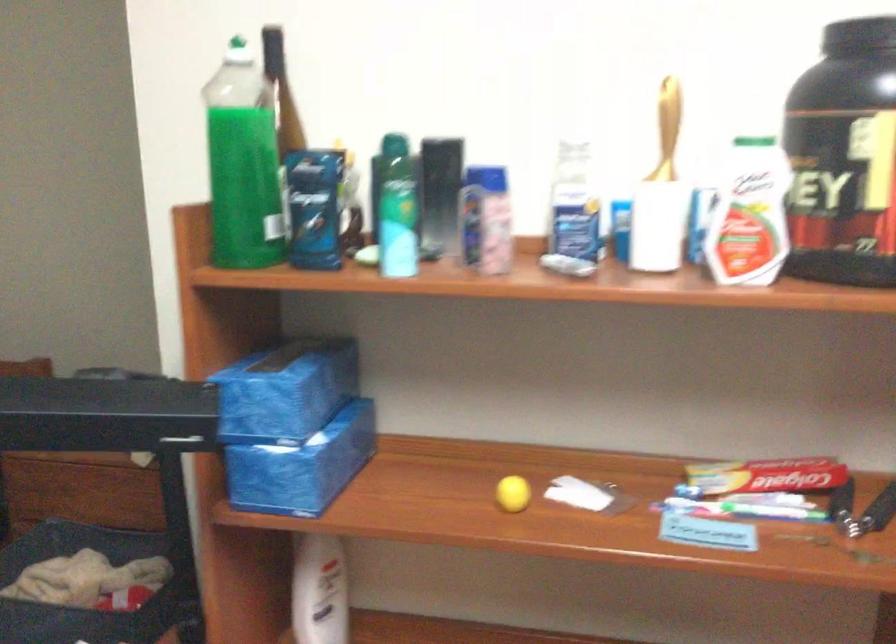
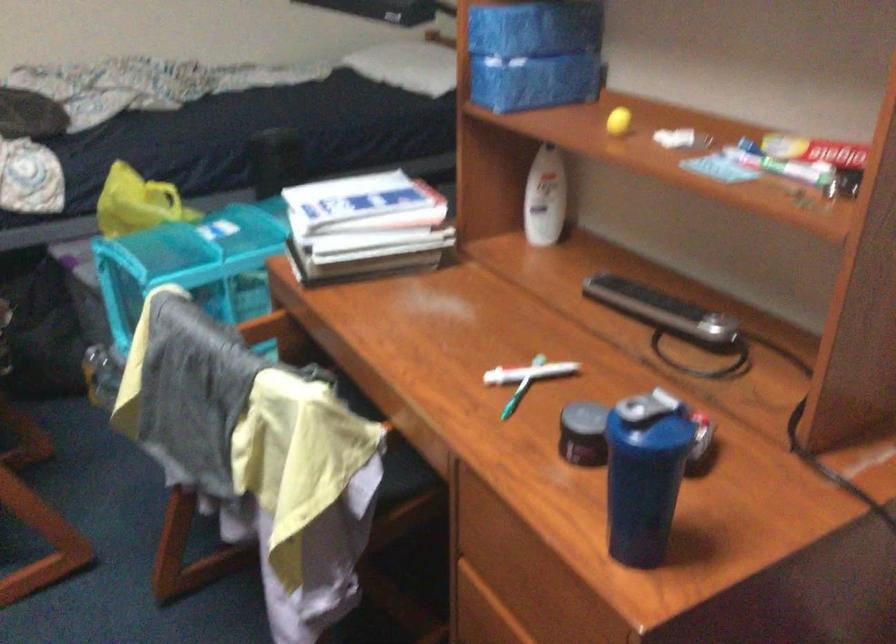
Find the pixel in the second image that matches the point at 512,489 in the first image.

(617, 120)